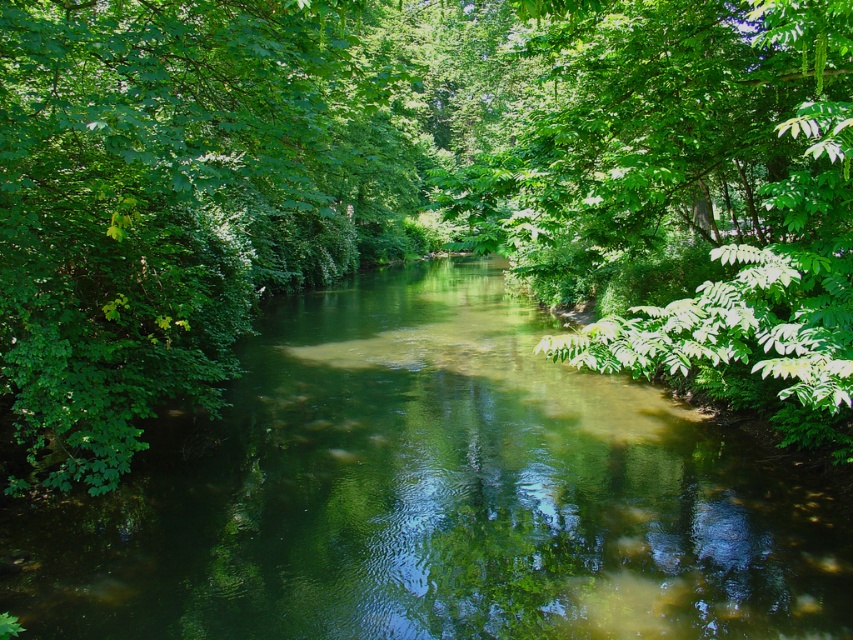
You are a small boat operator navigating the river. You need to pass through the area where the green translucent water at center and the green leafy tree at left are located. Can your boat, which is 1.2 meters wide, safely pass through the space between them?

The green translucent water at center might be wider than green leafy tree at left, so it is possible that the space between them is wide enough for the boat. However, since the exact width isn

You are standing at the edge of the river and see the point labeled as point (434,496). What is the nature of the water at that specific point?

The point (434,496) indicates green translucent water at center, so the water at that specific point is green and translucent.

You are a kayaker planning to paddle down the river shown in the image. You notice the green leafy tree at left and the green translucent water at center. Which object is closer to you as you face the river from the bank?

The green translucent water at center is closer to you because the green leafy tree at left is behind it, meaning the water is in front of the tree.